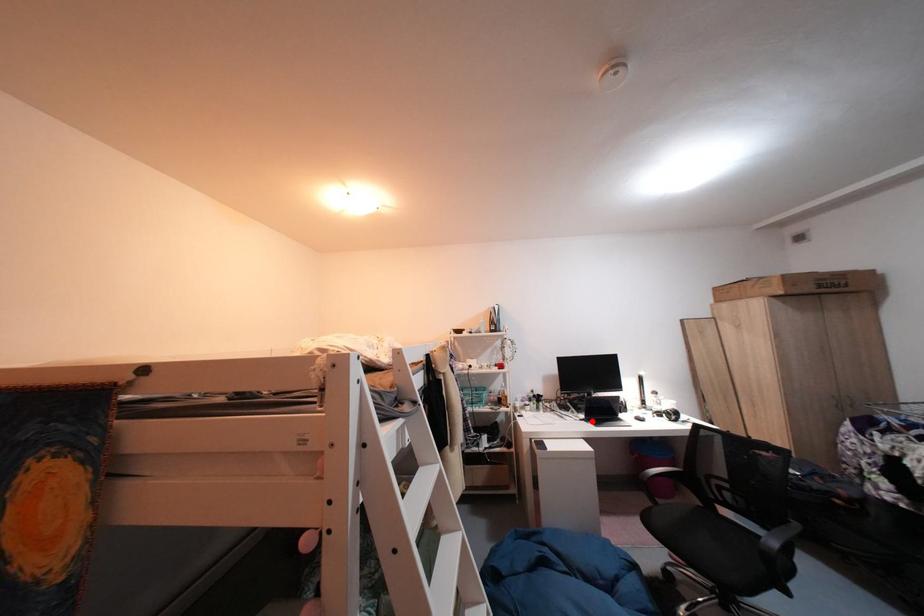
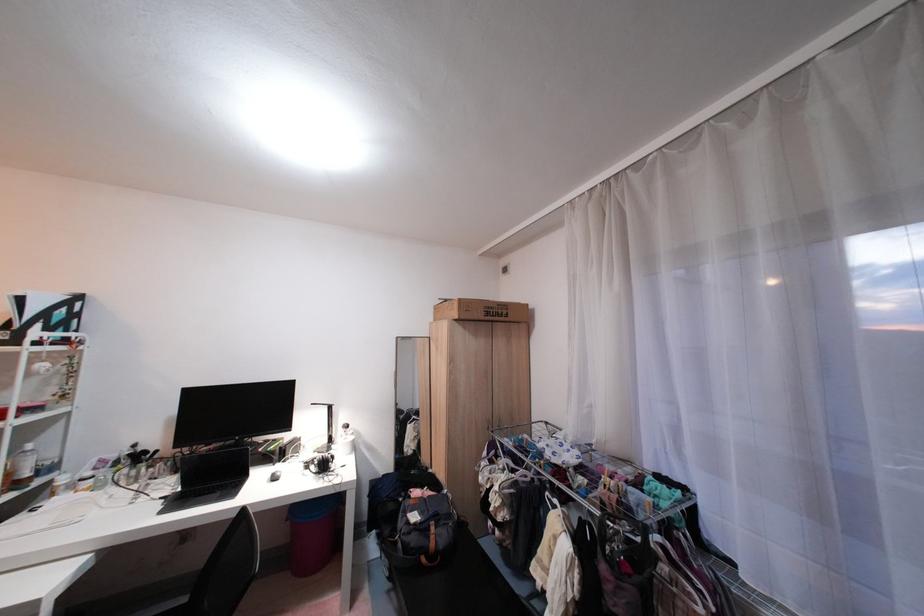
Question: I am providing you with two images of the same scene from different viewpoints. Image1 has a red point marked. In image2, the corresponding 3D location appears at what relative position? Reply with the corresponding letter.

Choices:
 (A) Closer
 (B) Farther

Answer: (A)